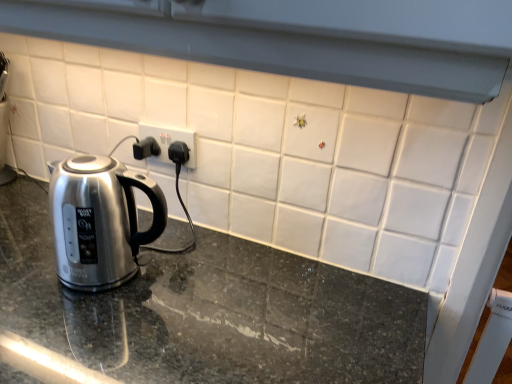
Question: From the image's perspective, would you say granite countertop at center is positioned over satin metallic kettle at left?

Choices:
 (A) no
 (B) yes

Answer: (A)

Question: Could you tell me if granite countertop at center is turned towards satin metallic kettle at left?

Choices:
 (A) yes
 (B) no

Answer: (B)

Question: Is granite countertop at center thinner than satin metallic kettle at left?

Choices:
 (A) no
 (B) yes

Answer: (A)

Question: Does granite countertop at center appear on the left side of satin metallic kettle at left?

Choices:
 (A) yes
 (B) no

Answer: (B)

Question: Can you confirm if granite countertop at center is shorter than satin metallic kettle at left?

Choices:
 (A) no
 (B) yes

Answer: (A)

Question: From the image's perspective, is granite countertop at center located beneath satin metallic kettle at left?

Choices:
 (A) no
 (B) yes

Answer: (B)

Question: Can you confirm if satin metallic kettle at left is shorter than white plastic electric outlet at center?

Choices:
 (A) no
 (B) yes

Answer: (A)

Question: Is satin metallic kettle at left not near white plastic electric outlet at center?

Choices:
 (A) no
 (B) yes

Answer: (A)

Question: From a real-world perspective, is satin metallic kettle at left physically below white plastic electric outlet at center?

Choices:
 (A) no
 (B) yes

Answer: (B)

Question: Is satin metallic kettle at left smaller than white plastic electric outlet at center?

Choices:
 (A) no
 (B) yes

Answer: (A)

Question: Could white plastic electric outlet at center be considered to be inside satin metallic kettle at left?

Choices:
 (A) no
 (B) yes

Answer: (A)

Question: Can you confirm if satin metallic kettle at left is wider than white plastic electric outlet at center?

Choices:
 (A) no
 (B) yes

Answer: (B)

Question: Is granite countertop at center not within white plastic electric outlet at center?

Choices:
 (A) no
 (B) yes

Answer: (B)